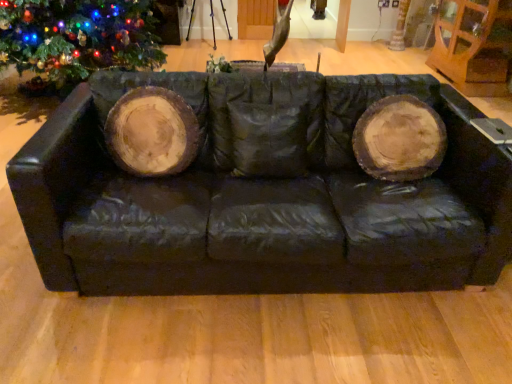
The width and height of the screenshot is (512, 384). What do you see at coordinates (77, 37) in the screenshot?
I see `green matte christmas tree at left` at bounding box center [77, 37].

Where is `green matte christmas tree at left`? green matte christmas tree at left is located at coordinates (77, 37).

Relative to black leather couch at center, is brown wood tree trunk at upper right in front or behind?

In the image, brown wood tree trunk at upper right appears behind black leather couch at center.

Would you say black leather couch at center is part of brown wood tree trunk at upper right's contents?

Definitely not — black leather couch at center is not inside brown wood tree trunk at upper right.

Considering the relative sizes of black leather couch at center and green matte christmas tree at left in the image provided, is black leather couch at center thinner than green matte christmas tree at left?

Correct, the width of black leather couch at center is less than that of green matte christmas tree at left.

Looking at the image, does black leather couch at center seem bigger or smaller compared to green matte christmas tree at left?

black leather couch at center is smaller than green matte christmas tree at left.

Is black leather couch at center oriented away from green matte christmas tree at left?

Correct, black leather couch at center is looking away from green matte christmas tree at left.

Can you tell me how much black leather couch at center and green matte christmas tree at left differ in facing direction?

They differ by 90.9 degrees in their facing directions.

How distant is brown wood tree trunk at upper right from green matte christmas tree at left?

brown wood tree trunk at upper right is 3.94 meters from green matte christmas tree at left.

Are brown wood tree trunk at upper right and green matte christmas tree at left far apart?

brown wood tree trunk at upper right is far away from green matte christmas tree at left.

Is brown wood tree trunk at upper right inside the boundaries of green matte christmas tree at left, or outside?

brown wood tree trunk at upper right cannot be found inside green matte christmas tree at left.

Looking at this image, which is closer, [398,27] or [57,7]?

The point [57,7] is closer.

Is green matte christmas tree at left to the left or to the right of black leather couch at center in the image?

green matte christmas tree at left is to the left of black leather couch at center.

Who is shorter, green matte christmas tree at left or black leather couch at center?

With less height is black leather couch at center.

From a real-world perspective, is green matte christmas tree at left located higher than black leather couch at center?

Yes, from a real-world perspective, green matte christmas tree at left is over black leather couch at center

From the picture: What's the angular difference between green matte christmas tree at left and black leather couch at center's facing directions?

green matte christmas tree at left and black leather couch at center are facing 90.9 degrees away from each other.

Considering the relative positions of black leather couch at center and brown wood tree trunk at upper right in the image provided, is black leather couch at center to the right of brown wood tree trunk at upper right from the viewer's perspective?

No, black leather couch at center is not to the right of brown wood tree trunk at upper right.

Which object is wider, black leather couch at center or brown wood tree trunk at upper right?

Wider between the two is black leather couch at center.

Is black leather couch at center beside brown wood tree trunk at upper right?

They are not placed beside each other.

At what (x,y) coordinates should I click in order to perform the action: click on christmas tree above the brown wood tree trunk at upper right (from a real-world perspective). Please return your answer as a coordinate pair (x, y). The width and height of the screenshot is (512, 384). Looking at the image, I should click on (77, 37).

Is green matte christmas tree at left facing away from brown wood tree trunk at upper right?

green matte christmas tree at left is not turned away from brown wood tree trunk at upper right.

In the scene shown: How much distance is there between green matte christmas tree at left and brown wood tree trunk at upper right?

green matte christmas tree at left and brown wood tree trunk at upper right are 3.94 meters apart from each other.

Considering the positions of point (2, 42) and point (398, 19), is point (2, 42) closer or farther from the camera than point (398, 19)?

Point (2, 42) is positioned closer to the camera compared to point (398, 19).

This screenshot has width=512, height=384. I want to click on tree trunk on the right side of black leather couch at center, so click(400, 27).

What are the coordinates of `christmas tree on the left side of black leather couch at center` in the screenshot? It's located at (77, 37).

Looking at the image, which one is located further to black leather couch at center, brown wood tree trunk at upper right or green matte christmas tree at left?

Among the two, brown wood tree trunk at upper right is located further to black leather couch at center.

When comparing their distances from brown wood tree trunk at upper right, does black leather couch at center or green matte christmas tree at left seem further?

black leather couch at center is positioned further to the anchor brown wood tree trunk at upper right.

From the image, which object appears to be nearer to green matte christmas tree at left, black leather couch at center or brown wood tree trunk at upper right?

Among the two, black leather couch at center is located nearer to green matte christmas tree at left.

Looking at the image, which one is located further to green matte christmas tree at left, brown wood tree trunk at upper right or black leather couch at center?

The object further to green matte christmas tree at left is brown wood tree trunk at upper right.

Estimate the real-world distances between objects in this image. Which object is further from black leather couch at center, green matte christmas tree at left or brown wood tree trunk at upper right?

brown wood tree trunk at upper right.

Looking at the image, which one is located closer to brown wood tree trunk at upper right, green matte christmas tree at left or black leather couch at center?

green matte christmas tree at left.

This screenshot has height=384, width=512. Find the location of `christmas tree positioned between black leather couch at center and brown wood tree trunk at upper right from near to far`. christmas tree positioned between black leather couch at center and brown wood tree trunk at upper right from near to far is located at coordinates (77, 37).